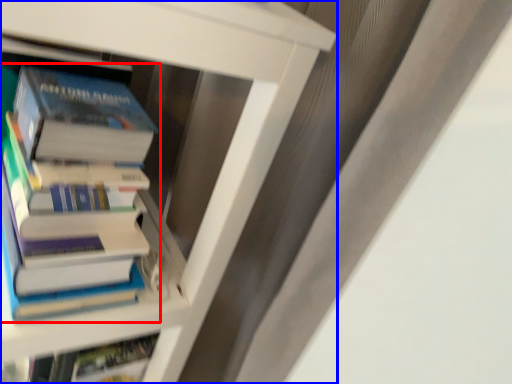
Question: Which object is further to the camera taking this photo, book (highlighted by a red box) or book (highlighted by a blue box)?

Choices:
 (A) book
 (B) book

Answer: (A)